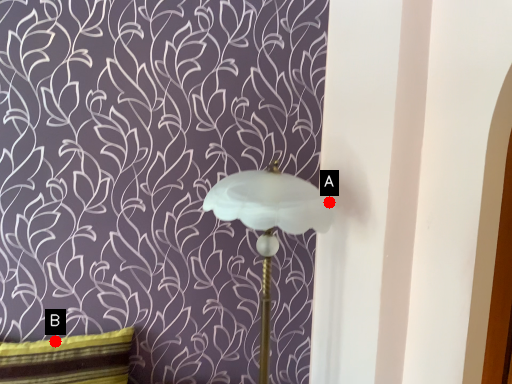
Question: Two points are circled on the image, labeled by A and B beside each circle. Among these points, which one is farthest from the camera?

Choices:
 (A) A is further
 (B) B is further

Answer: (B)